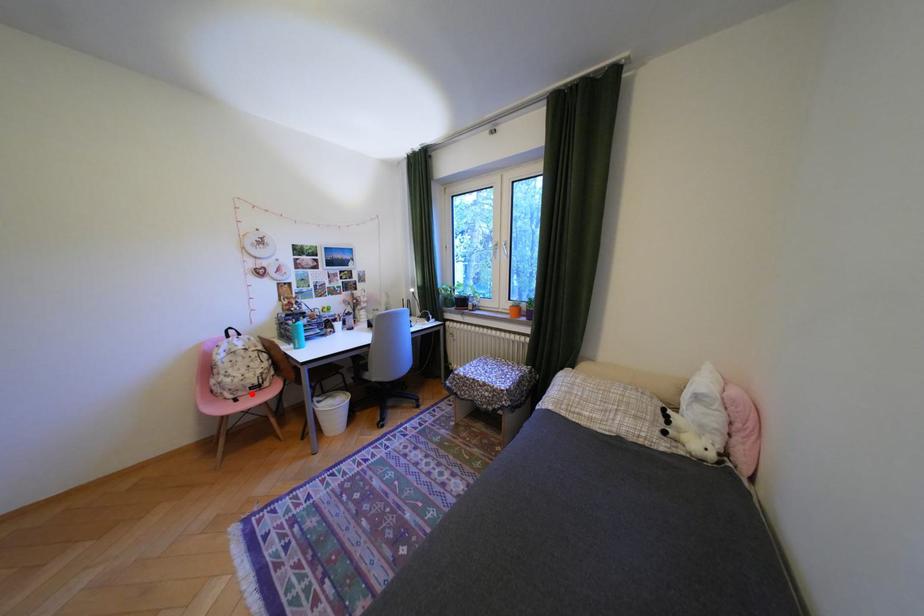
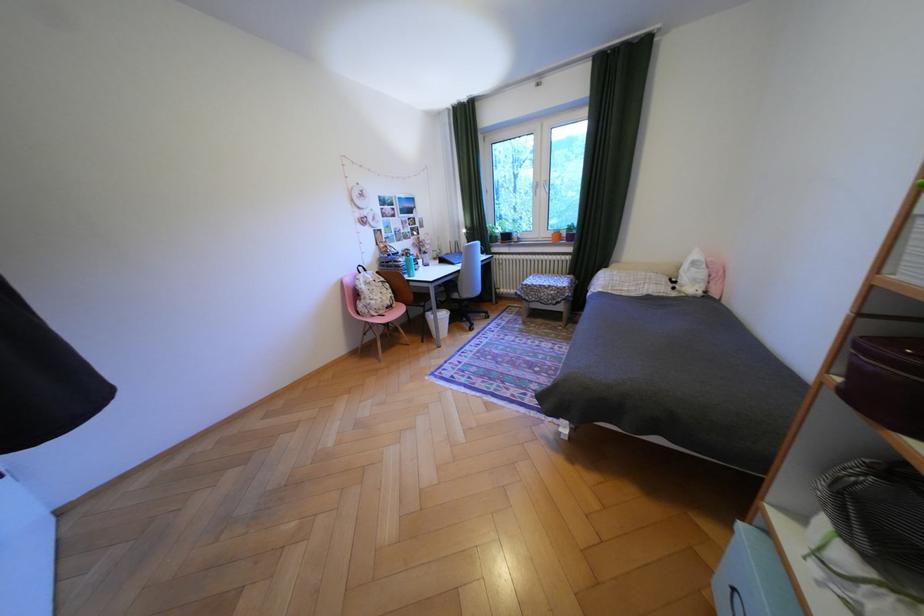
In the second image, find the point that corresponds to the highlighted location in the first image.

(393, 312)